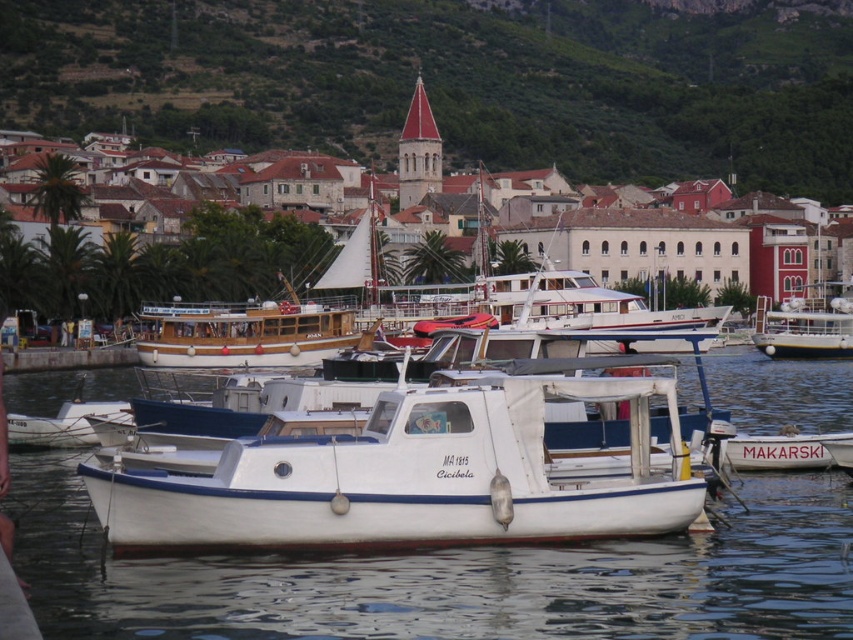
You are a tourist standing at the edge of the harbor and want to take a photo of the white stone buildings at center and the white matte boat at center. Which one is located behind the other?

The white stone buildings at center is positioned over white matte boat at center, meaning the white stone buildings at center are behind the white matte boat at center.

You are standing on the dock and looking towards the white stone buildings at center and the white matte boat at center. Which one appears taller from your perspective?

The white stone buildings at center appear taller than the white matte boat at center because the white stone buildings at center has a greater height compared to the white matte boat at center.

You are planning to place a new bench in the harbor scene so that it can be seen from both the green grassy hillside at upper center and the white matte boat at center. Based on their positions, which object is wider and could potentially offer a better vantage point for viewing the bench?

The green grassy hillside at upper center might be wider than the white matte boat at center, so it could offer a better vantage point for viewing the bench from both locations.